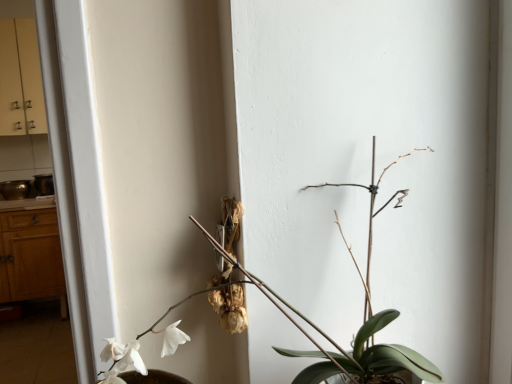
Question: From the image's perspective, does wooden counter top at left appear higher than wooden dresser at left?

Choices:
 (A) yes
 (B) no

Answer: (A)

Question: Considering the relative sizes of wooden counter top at left and wooden dresser at left in the image provided, is wooden counter top at left thinner than wooden dresser at left?

Choices:
 (A) yes
 (B) no

Answer: (A)

Question: Is wooden counter top at left smaller than wooden dresser at left?

Choices:
 (A) no
 (B) yes

Answer: (B)

Question: Considering the relative sizes of wooden counter top at left and wooden dresser at left in the image provided, is wooden counter top at left wider than wooden dresser at left?

Choices:
 (A) yes
 (B) no

Answer: (B)

Question: Considering the relative sizes of wooden counter top at left and wooden dresser at left in the image provided, is wooden counter top at left taller than wooden dresser at left?

Choices:
 (A) no
 (B) yes

Answer: (A)

Question: In the image, is wooden dresser at left on the left side or the right side of green matte plant at center?

Choices:
 (A) right
 (B) left

Answer: (B)

Question: Looking at the image, does wooden dresser at left seem bigger or smaller compared to green matte plant at center?

Choices:
 (A) big
 (B) small

Answer: (A)

Question: Which is correct: wooden dresser at left is inside green matte plant at center, or outside of it?

Choices:
 (A) inside
 (B) outside

Answer: (B)

Question: From the image's perspective, is wooden dresser at left above or below green matte plant at center?

Choices:
 (A) below
 (B) above

Answer: (A)

Question: Relative to wooden dresser at left, is green matte plant at center in front or behind?

Choices:
 (A) behind
 (B) front

Answer: (B)

Question: Considering the positions of green matte plant at center and wooden dresser at left in the image, is green matte plant at center taller or shorter than wooden dresser at left?

Choices:
 (A) short
 (B) tall

Answer: (A)

Question: Is green matte plant at center spatially inside wooden dresser at left, or outside of it?

Choices:
 (A) inside
 (B) outside

Answer: (B)

Question: Is point (241, 329) positioned closer to the camera than point (46, 233)?

Choices:
 (A) farther
 (B) closer

Answer: (B)

Question: In terms of size, does wooden counter top at left appear bigger or smaller than green matte plant at center?

Choices:
 (A) big
 (B) small

Answer: (B)

Question: Considering the positions of wooden counter top at left and green matte plant at center in the image, is wooden counter top at left taller or shorter than green matte plant at center?

Choices:
 (A) short
 (B) tall

Answer: (A)